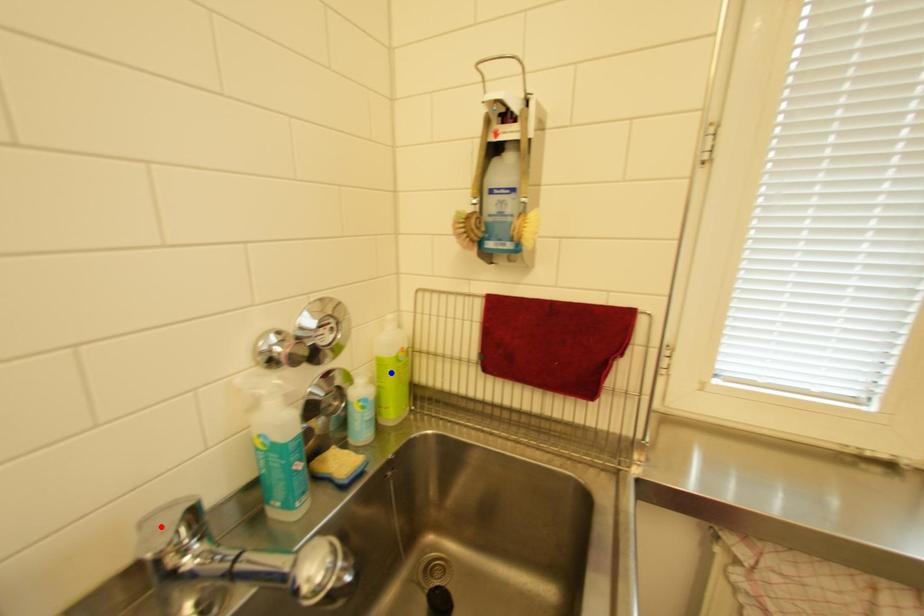
Question: In the image, two points are highlighted. Which point is nearer to the camera? Reply with the corresponding letter.

Choices:
 (A) blue point
 (B) red point

Answer: (B)